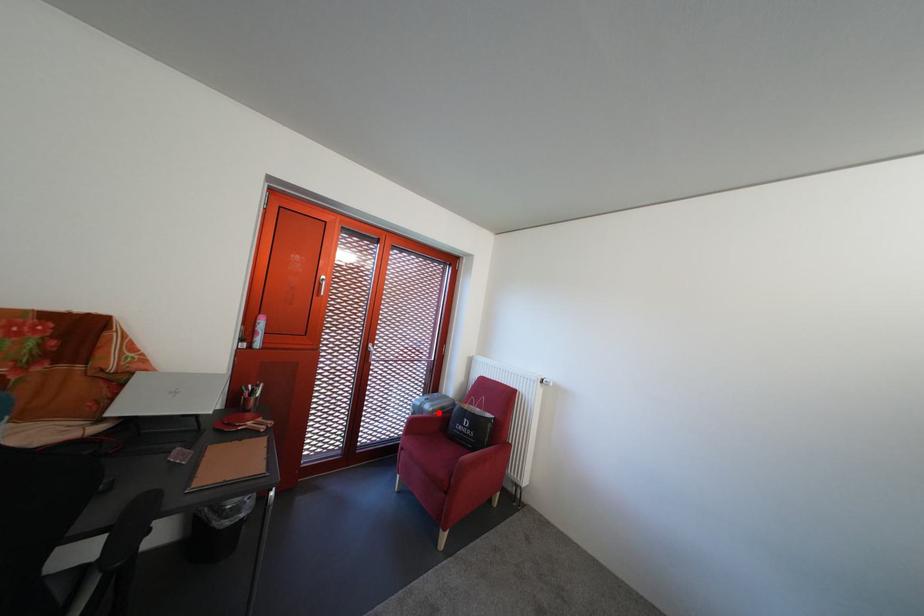
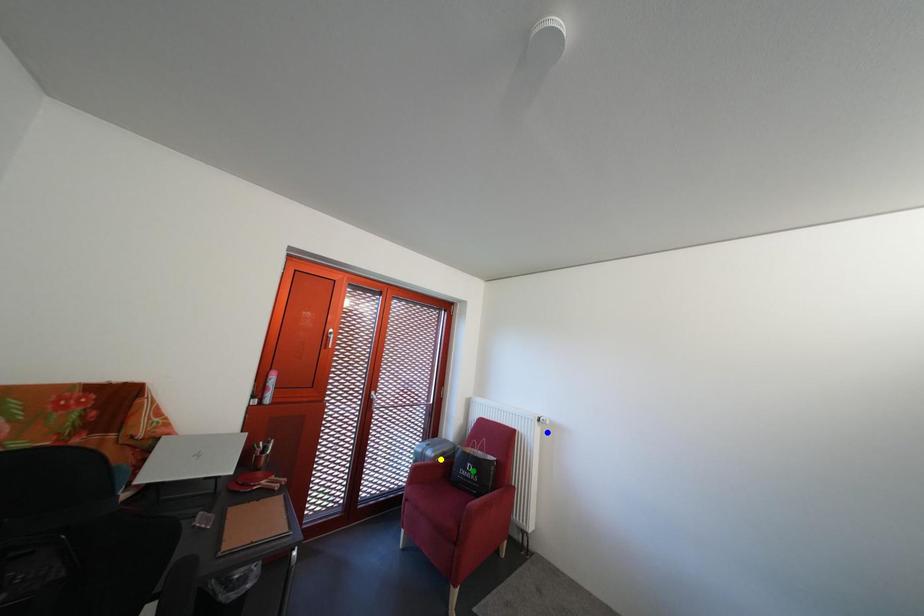
Question: I am providing you with two images of the same scene from different viewpoints. A red point is marked on the first image. You are given multiple points on the second image. In image 2, which mark is for the same physical point as the one in image 1?

Choices:
 (A) green point
 (B) blue point
 (C) yellow point

Answer: (C)